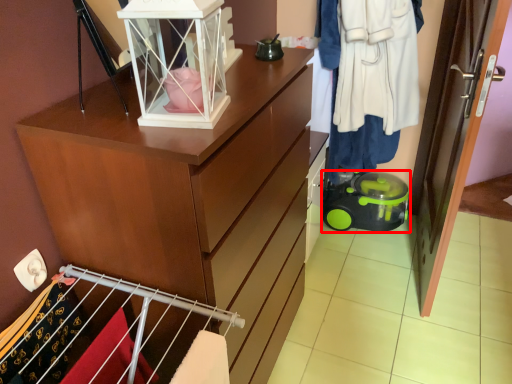
Question: From the image's perspective, considering the relative positions of toy (annotated by the red box) and clothing in the image provided, where is toy (annotated by the red box) located with respect to the staircase?

Choices:
 (A) above
 (B) below

Answer: (B)